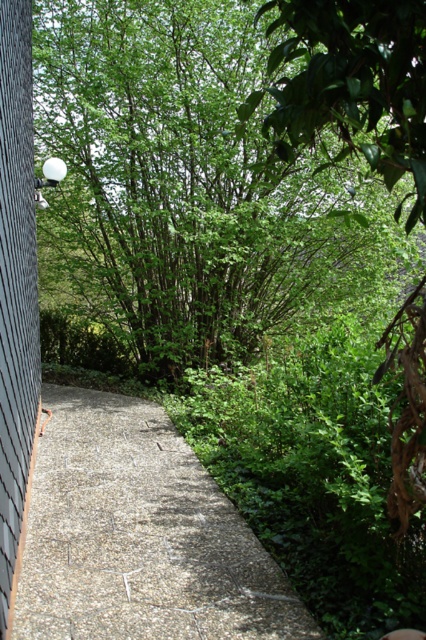
Can you confirm if green leafy tree at upper center is positioned to the right of gravelly stone path at center?

Yes, green leafy tree at upper center is to the right of gravelly stone path at center.

Who is more distant from viewer, (288, 220) or (172, 534)?

The point (288, 220) is behind.

Image resolution: width=426 pixels, height=640 pixels. In order to click on green leafy tree at upper center in this screenshot , I will do pyautogui.click(x=213, y=157).

Between point (144, 512) and point (34, 396), which one is positioned behind?

Point (34, 396)

Does point (245, 627) come behind point (0, 340)?

That is False.

At what (x,y) coordinates should I click in order to perform the action: click on gravelly stone path at center. Please return your answer as a coordinate pair (x, y). Looking at the image, I should click on (138, 536).

Is green leafy tree at upper center below gray textured siding at left?

Incorrect, green leafy tree at upper center is not positioned below gray textured siding at left.

Does green leafy tree at upper center have a larger size compared to gray textured siding at left?

Correct, green leafy tree at upper center is larger in size than gray textured siding at left.

Where is `green leafy tree at upper center`? Image resolution: width=426 pixels, height=640 pixels. green leafy tree at upper center is located at coordinates (213, 157).